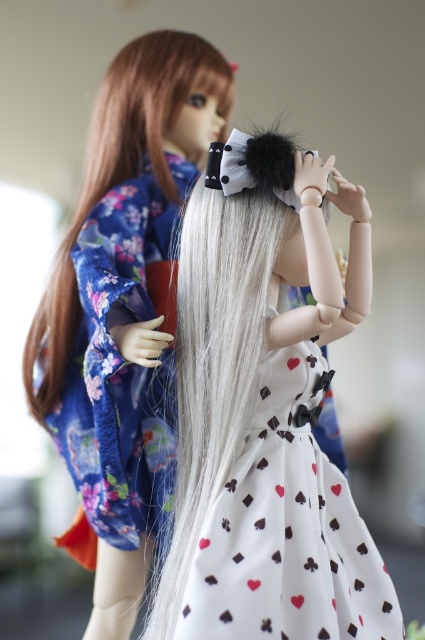
Is white printed fabric dress at center above white matte dress at center?

No, white printed fabric dress at center is not above white matte dress at center.

You are a GUI agent. You are given a task and a screenshot of the screen. Output one action in this format:
    pyautogui.click(x=<x>, y=<y>)
    Task: Click on the white printed fabric dress at center
    The image size is (425, 640).
    Given the screenshot: What is the action you would take?
    pyautogui.click(x=286, y=529)

Looking at this image, who is taller, white printed fabric dress at center or white silky hair at upper left?

white silky hair at upper left is taller.

Is white printed fabric dress at center thinner than white silky hair at upper left?

Indeed, white printed fabric dress at center has a lesser width compared to white silky hair at upper left.

You are a GUI agent. You are given a task and a screenshot of the screen. Output one action in this format:
    pyautogui.click(x=<x>, y=<y>)
    Task: Click on the white printed fabric dress at center
    
    Given the screenshot: What is the action you would take?
    pyautogui.click(x=286, y=529)

Is point (132, 301) in front of point (33, 408)?

Yes, it is.

Can you confirm if white matte dress at center is smaller than white silky hair at upper left?

Yes, white matte dress at center is smaller than white silky hair at upper left.

Between point (158, 285) and point (155, 92), which one is positioned in front?

Point (158, 285) is more forward.

The image size is (425, 640). I want to click on white matte dress at center, so click(119, 371).